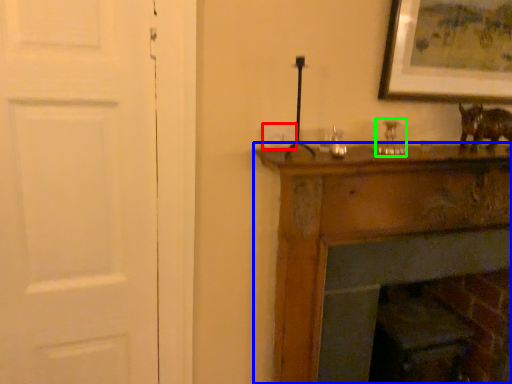
Question: Considering the real-world distances, which object is farthest from light switch (highlighted by a red box)? furniture (highlighted by a blue box) or candle holder (highlighted by a green box)?

Choices:
 (A) furniture
 (B) candle holder

Answer: (A)